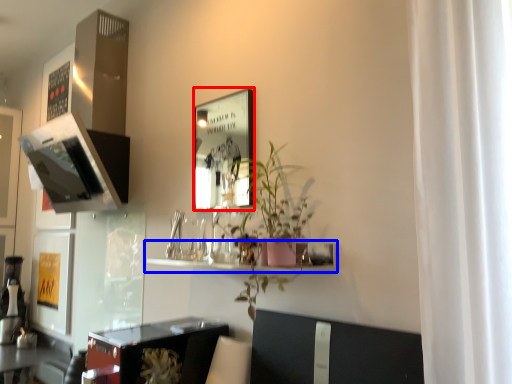
Question: Which object appears farthest to the camera in this image, picture frame (highlighted by a red box) or shelf (highlighted by a blue box)?

Choices:
 (A) picture frame
 (B) shelf

Answer: (A)